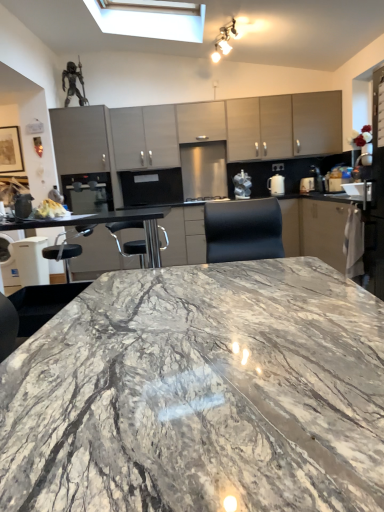
Question: Is satin black coffee machine at center, marked as the third appliance in a right-to-left arrangement, wider or thinner than white glossy kettle at right, which is counted as the first appliance, starting from the right?

Choices:
 (A) thin
 (B) wide

Answer: (B)

Question: From a real-world perspective, is satin black coffee machine at center, marked as the third appliance in a right-to-left arrangement, above or below white glossy kettle at right, acting as the third appliance starting from the left?

Choices:
 (A) below
 (B) above

Answer: (B)

Question: Based on their relative distances, which object is farther from the satin black coffee machine at center, marked as the third appliance in a right-to-left arrangement?

Choices:
 (A) marble countertop at center
 (B) white plastic coffee machine at right
 (C) white crumbly bread at left
 (D) satin silver toaster at upper center, which ranks as the 2th appliance in left-to-right order
 (E) matte gray cabinets at center, the 1th cabinetry in the left-to-right sequence

Answer: (B)

Question: Which object is positioned closest to the marble countertop at center?

Choices:
 (A) marble countertop at center
 (B) white plastic coffee machine at right
 (C) matte gray cabinets at upper center, the third cabinetry in the left-to-right sequence
 (D) white glossy kettle at right, acting as the third appliance starting from the left
 (E) matte gray cabinet at upper center, the second cabinetry in the right-to-left sequence

Answer: (B)